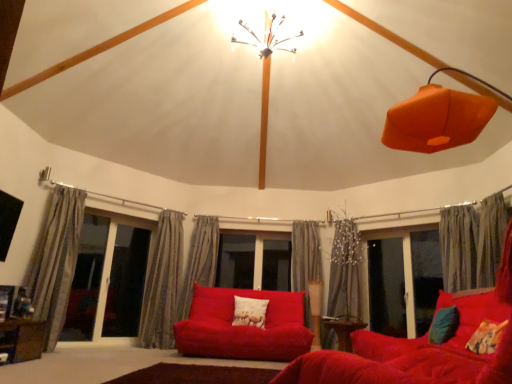
What do you see at coordinates (308, 271) in the screenshot?
I see `gray textured curtain at center, which is counted as the 4th curtain, starting from the left` at bounding box center [308, 271].

The height and width of the screenshot is (384, 512). What are the coordinates of `gray textured curtain at center, which is counted as the 4th curtain, starting from the left` in the screenshot? It's located at (308, 271).

Locate an element on the screen. Image resolution: width=512 pixels, height=384 pixels. transparent glass screen door at lower left, which appears as the second screen door when viewed from the left is located at coordinates (126, 282).

What is the approximate width of brown wooden table at lower left, which appears as the first table when viewed from the left?

brown wooden table at lower left, which appears as the first table when viewed from the left, is 18.67 inches in width.

You are a GUI agent. You are given a task and a screenshot of the screen. Output one action in this format:
    pyautogui.click(x=<x>, y=<y>)
    Task: Click on the gray textured curtain at center, which is counted as the 4th curtain, starting from the left
    The height and width of the screenshot is (384, 512).
    Given the screenshot: What is the action you would take?
    pyautogui.click(x=308, y=271)

Can you confirm if gray textured curtain at right, positioned as the second curtain in right-to-left order, is bigger than velvet red sofa at lower right, arranged as the 1th studio couch when viewed from the front?

No, gray textured curtain at right, positioned as the second curtain in right-to-left order, is not bigger than velvet red sofa at lower right, arranged as the 1th studio couch when viewed from the front.

Is gray textured curtain at right, positioned as the second curtain in right-to-left order, to the left or to the right of velvet red sofa at lower right, the 1th studio couch positioned from the right, in the image?

Clearly, gray textured curtain at right, positioned as the second curtain in right-to-left order, is on the right of velvet red sofa at lower right, the 1th studio couch positioned from the right, in the image.

Considering the relative sizes of gray textured curtain at right, which is the 6th curtain in left-to-right order, and velvet red sofa at lower right, acting as the second studio couch starting from the left, in the image provided, is gray textured curtain at right, which is the 6th curtain in left-to-right order, shorter than velvet red sofa at lower right, acting as the second studio couch starting from the left,?

Incorrect, the height of gray textured curtain at right, which is the 6th curtain in left-to-right order, does not fall short of that of velvet red sofa at lower right, acting as the second studio couch starting from the left.

Is brown wooden table at lower left, the 2th table in the bottom-to-top sequence, at the left side of gray textured curtain at right, which is the 6th curtain in left-to-right order?

Indeed, brown wooden table at lower left, the 2th table in the bottom-to-top sequence, is positioned on the left side of gray textured curtain at right, which is the 6th curtain in left-to-right order.

From a real-world perspective, who is located lower, brown wooden table at lower left, which appears as the first table when viewed from the left, or gray textured curtain at right, positioned as the second curtain in right-to-left order?

From a 3D spatial view, brown wooden table at lower left, which appears as the first table when viewed from the left, is below.

What's the angular difference between brown wooden table at lower left, the second table when ordered from right to left, and gray textured curtain at right, positioned as the second curtain in right-to-left order,'s facing directions?

They differ by 145 degrees in their facing directions.

Considering the sizes of objects velvet red sofa at lower right, the 1th studio couch positioned from the right, and teal fabric pillow at lower right, which is the second pillow from front to back, in the image provided, who is shorter, velvet red sofa at lower right, the 1th studio couch positioned from the right, or teal fabric pillow at lower right, which is the second pillow from front to back,?

With less height is teal fabric pillow at lower right, which is the second pillow from front to back.

Is velvet red sofa at lower right, acting as the second studio couch starting from the left, turned away from teal fabric pillow at lower right, which is the second pillow from front to back?

Yes.

Considering the relative positions of velvet red sofa at lower right, acting as the second studio couch starting from the left, and teal fabric pillow at lower right, arranged as the first pillow when viewed from the right, in the image provided, is velvet red sofa at lower right, acting as the second studio couch starting from the left, to the left or to the right of teal fabric pillow at lower right, arranged as the first pillow when viewed from the right,?

velvet red sofa at lower right, acting as the second studio couch starting from the left, is to the left of teal fabric pillow at lower right, arranged as the first pillow when viewed from the right.

Which point is more distant from viewer, [397,360] or [446,328]?

The point [446,328] is farther from the camera.

Do you think metallic wire chandelier at upper center is within gray textured curtain at center, which is counted as the 4th curtain, starting from the left, or outside of it?

metallic wire chandelier at upper center is not inside gray textured curtain at center, which is counted as the 4th curtain, starting from the left, it's outside.

In the scene shown: From a real-world perspective, relative to gray textured curtain at center, which is the 4th curtain in right-to-left order, is metallic wire chandelier at upper center vertically above or below?

In terms of real-world spatial position, metallic wire chandelier at upper center is above gray textured curtain at center, which is the 4th curtain in right-to-left order.

Is metallic wire chandelier at upper center shorter than gray textured curtain at center, which is counted as the 4th curtain, starting from the left?

Yes, metallic wire chandelier at upper center is shorter than gray textured curtain at center, which is counted as the 4th curtain, starting from the left.

Is metallic wire chandelier at upper center not near gray textured curtain at center, which is counted as the 4th curtain, starting from the left?

Yes.

From the image's perspective, which is above, transparent glass window at right or gray textured curtain at left, which is the first curtain from left to right?

gray textured curtain at left, which is the first curtain from left to right, is shown above in the image.

Is transparent glass window at right turned away from gray textured curtain at left, which is the 7th curtain from right to left?

transparent glass window at right is not turned away from gray textured curtain at left, which is the 7th curtain from right to left.

Is transparent glass window at right far away from gray textured curtain at left, which is the 7th curtain from right to left?

Yes, transparent glass window at right and gray textured curtain at left, which is the 7th curtain from right to left, are quite far apart.

Is gray textured curtain at center, the 5th curtain in the right-to-left sequence, not close to transparent glass window at right?

gray textured curtain at center, the 5th curtain in the right-to-left sequence, is far away from transparent glass window at right.

Does gray textured curtain at center, which ranks as the 3th curtain in left-to-right order, turn towards transparent glass window at right?

No, gray textured curtain at center, which ranks as the 3th curtain in left-to-right order, is not facing towards transparent glass window at right.

The width and height of the screenshot is (512, 384). What are the coordinates of `the 2nd curtain positioned above the transparent glass window at right (from the image's perspective)` in the screenshot? It's located at (199, 261).

Is matte red couch at center, positioned as the second studio couch in front-to-back order, inside or outside of gray textured curtain at right, which is the 6th curtain in left-to-right order?

matte red couch at center, positioned as the second studio couch in front-to-back order, exists outside the volume of gray textured curtain at right, which is the 6th curtain in left-to-right order.

Is matte red couch at center, the first studio couch from the back, positioned with its back to gray textured curtain at right, which is the 6th curtain in left-to-right order?

No, gray textured curtain at right, which is the 6th curtain in left-to-right order, is not at the back of matte red couch at center, the first studio couch from the back.

Which is in front, point (290, 337) or point (453, 217)?

Point (453, 217)

Who is smaller, matte red couch at center, the first studio couch from the back, or gray textured curtain at right, which is the 6th curtain in left-to-right order?

With smaller size is gray textured curtain at right, which is the 6th curtain in left-to-right order.

Image resolution: width=512 pixels, height=384 pixels. Find the location of `studio couch in front of the gray textured curtain at right, which is the 6th curtain in left-to-right order`. studio couch in front of the gray textured curtain at right, which is the 6th curtain in left-to-right order is located at coordinates pyautogui.click(x=413, y=354).

You are a GUI agent. You are given a task and a screenshot of the screen. Output one action in this format:
    pyautogui.click(x=<x>, y=<y>)
    Task: Click on the 2nd table positioned below the gray textured curtain at right, which is the 6th curtain in left-to-right order (from a real-world perspective)
    
    Given the screenshot: What is the action you would take?
    pyautogui.click(x=22, y=339)

Estimate the real-world distances between objects in this image. Which object is closer to gray textured curtain at center, the 3th curtain when ordered from right to left, velvet red sofa at lower right, the 1th studio couch positioned from the right, or brown wooden table at lower left, the first table when ordered from front to back?

velvet red sofa at lower right, the 1th studio couch positioned from the right, lies closer to gray textured curtain at center, the 3th curtain when ordered from right to left, than the other object.

Which object lies further to the anchor point white textured pillow at center, the third pillow from the front, transparent glass window at right or velvet red sofa at lower right, the 1th studio couch positioned from the right?

velvet red sofa at lower right, the 1th studio couch positioned from the right, is positioned further to the anchor white textured pillow at center, the third pillow from the front.

Looking at the image, which one is located further to metallic wire chandelier at upper center, gray textured curtain at center, which is the 4th curtain in right-to-left order, or fluffy multicolored pillow at lower right, placed as the 2th pillow when sorted from right to left?

The object further to metallic wire chandelier at upper center is fluffy multicolored pillow at lower right, placed as the 2th pillow when sorted from right to left.

When comparing their distances from transparent glass screen door at lower left, which appears as the second screen door when viewed from the left, does gray textured curtain at right, which is the 6th curtain in left-to-right order, or matte red couch at center, acting as the 2th studio couch starting from the right, seem closer?

matte red couch at center, acting as the 2th studio couch starting from the right, is closer to transparent glass screen door at lower left, which appears as the second screen door when viewed from the left.

Looking at the image, which one is located further to gray textured curtain at center, which ranks as the 3th curtain in left-to-right order, white textured pillow at center, the third pillow from the front, or gray textured curtain at right, arranged as the first curtain when viewed from the right?

Among the two, gray textured curtain at right, arranged as the first curtain when viewed from the right, is located further to gray textured curtain at center, which ranks as the 3th curtain in left-to-right order.

From the image, which object appears to be nearer to gray textured curtain at right, positioned as the 7th curtain in left-to-right order, gray textured curtain at center, placed as the sixth curtain when sorted from right to left, or gray textured curtain at left, which is the first curtain from left to right?

The object closer to gray textured curtain at right, positioned as the 7th curtain in left-to-right order, is gray textured curtain at center, placed as the sixth curtain when sorted from right to left.

Considering their positions, is transparent glass window at right positioned further to metallic wire chandelier at upper center than matte red couch at center, acting as the 2th studio couch starting from the right?

Based on the image, transparent glass window at right appears to be further to metallic wire chandelier at upper center.

Considering their positions, is gray textured curtain at right, arranged as the first curtain when viewed from the right, positioned closer to brown rug at lower center than velvet red sofa at lower right, the 1th studio couch positioned from the right?

Among the two, velvet red sofa at lower right, the 1th studio couch positioned from the right, is located nearer to brown rug at lower center.

You are a GUI agent. You are given a task and a screenshot of the screen. Output one action in this format:
    pyautogui.click(x=<x>, y=<y>)
    Task: Click on the table between white textured pillow at center, the third pillow from the front, and transparent glass window at right, in the horizontal direction
    
    Given the screenshot: What is the action you would take?
    pyautogui.click(x=343, y=330)

Where is `window between gray textured curtain at center, which is counted as the 4th curtain, starting from the left, and gray textured curtain at right, positioned as the second curtain in right-to-left order, from left to right`? The width and height of the screenshot is (512, 384). window between gray textured curtain at center, which is counted as the 4th curtain, starting from the left, and gray textured curtain at right, positioned as the second curtain in right-to-left order, from left to right is located at coordinates (403, 279).

Where is `studio couch between brown rug at lower center and transparent glass screen door at lower left, the 1th screen door in the right-to-left sequence, along the z-axis`? The image size is (512, 384). studio couch between brown rug at lower center and transparent glass screen door at lower left, the 1th screen door in the right-to-left sequence, along the z-axis is located at coordinates (244, 326).

Image resolution: width=512 pixels, height=384 pixels. What are the coordinates of `screen door between transparent glass screen door at left, which is counted as the 2th screen door, starting from the right, and white textured pillow at center, which is the 1th pillow from left to right, from left to right` in the screenshot? It's located at (126, 282).